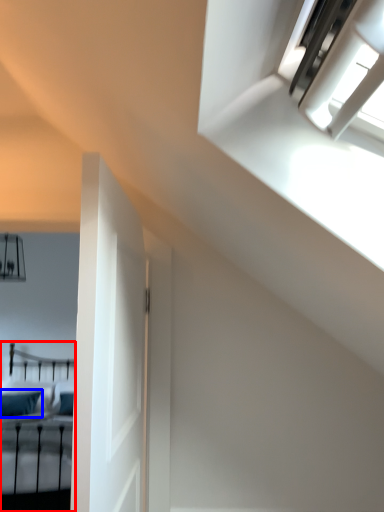
Question: Which object appears closest to the camera in this image, bed (highlighted by a red box) or pillow (highlighted by a blue box)?

Choices:
 (A) bed
 (B) pillow

Answer: (A)